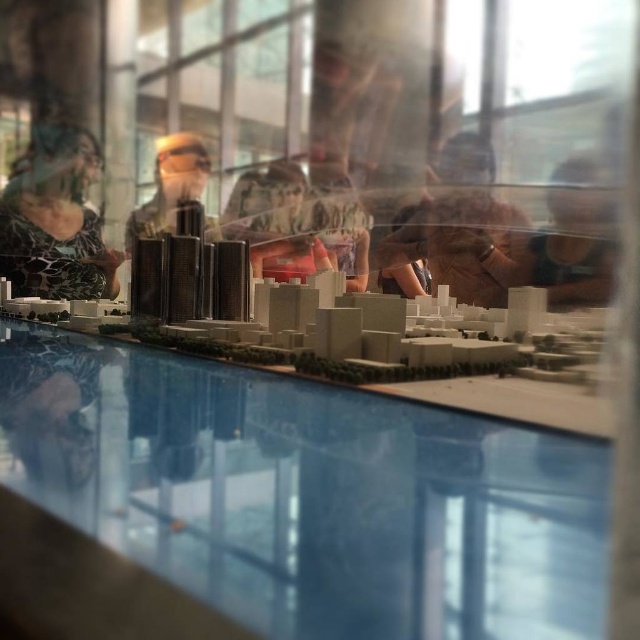
Does transparent glass table at center appear on the left side of brown leather jacket at center?

Correct, you'll find transparent glass table at center to the left of brown leather jacket at center.

Does point (392, 413) lie behind point (465, 204)?

That is False.

Identify the location of transparent glass table at center. (307, 493).

Which is below, transparent glass table at center or smooth brown hair at upper right?

transparent glass table at center is lower down.

Find the location of `transparent glass table at center`. transparent glass table at center is located at coordinates (307, 493).

Between transparent glass table at center and smooth beige building at center, which one has more height?

Standing taller between the two is smooth beige building at center.

The image size is (640, 640). What do you see at coordinates (307, 493) in the screenshot?
I see `transparent glass table at center` at bounding box center [307, 493].

Between point (556, 618) and point (262, 257), which one is positioned behind?

Point (262, 257)

At what (x,y) coordinates should I click in order to perform the action: click on transparent glass table at center. Please return your answer as a coordinate pair (x, y). Looking at the image, I should click on (307, 493).